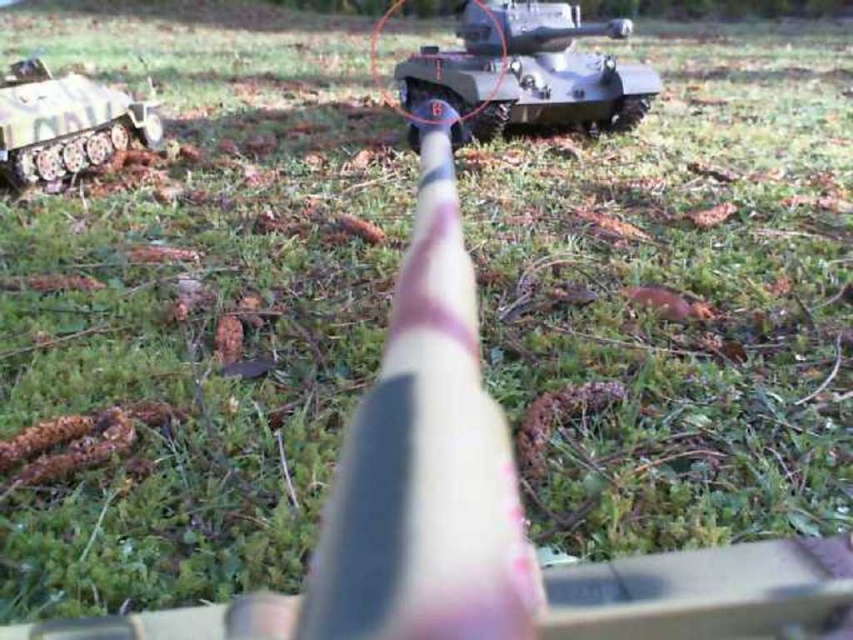
You are a child playing with toy tanks. You have a matte gray tank at center and a camouflage paint tank at left. Which tank is closer to you?

The matte gray tank at center is closer to you because it is positioned over the camouflage paint tank at left.

You are a toy soldier standing on the grassy terrain. You see the matte gray tank at center and the camouflage paint tank at left. Which tank is closer to your right side?

The matte gray tank at center is positioned on the right side of camouflage paint tank at left, so if you are facing the scene, the matte gray tank at center would be closer to your right side.